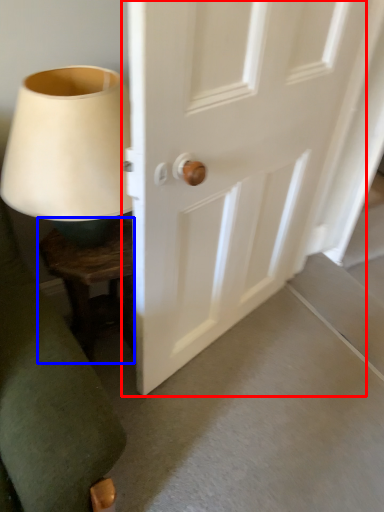
Question: Which point is closer to the camera, door (highlighted by a red box) or furniture (highlighted by a blue box)?

Choices:
 (A) door
 (B) furniture

Answer: (A)